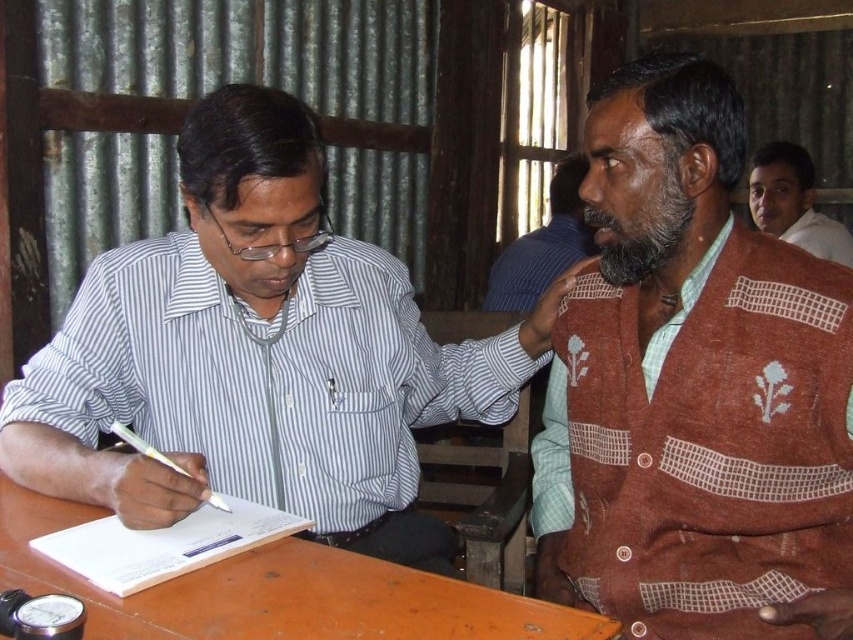
Question: Can you confirm if brown wooden table at lower left is wider than brown knitted sweater at upper right?

Choices:
 (A) yes
 (B) no

Answer: (A)

Question: Among these objects, which one is farthest from the camera?

Choices:
 (A) brown knitted sweater at right
 (B) light brown skin at upper right
 (C) brown knitted sweater at upper right
 (D) striped cotton shirt at left

Answer: (B)

Question: Which object is farther from the camera taking this photo?

Choices:
 (A) white paper at lower left
 (B) striped cotton shirt at left
 (C) light brown skin at upper right
 (D) brown knitted sweater at upper right

Answer: (C)

Question: Does brown knitted sweater at right come behind striped cotton shirt at left?

Choices:
 (A) no
 (B) yes

Answer: (A)

Question: Is striped cotton shirt at left below light brown skin at upper right?

Choices:
 (A) yes
 (B) no

Answer: (A)

Question: Among these objects, which one is nearest to the camera?

Choices:
 (A) brown knitted sweater at right
 (B) white paper at lower left
 (C) striped cotton shirt at left

Answer: (B)